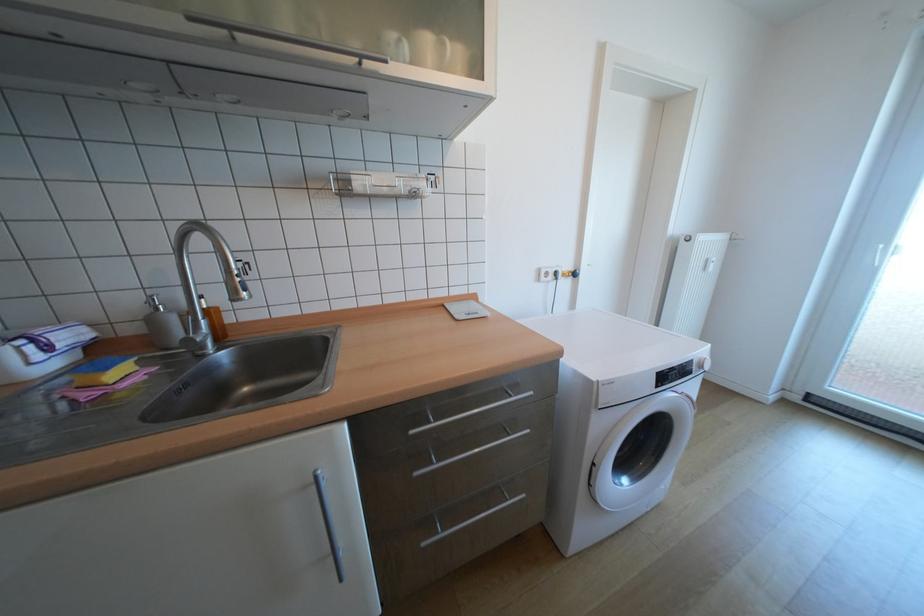
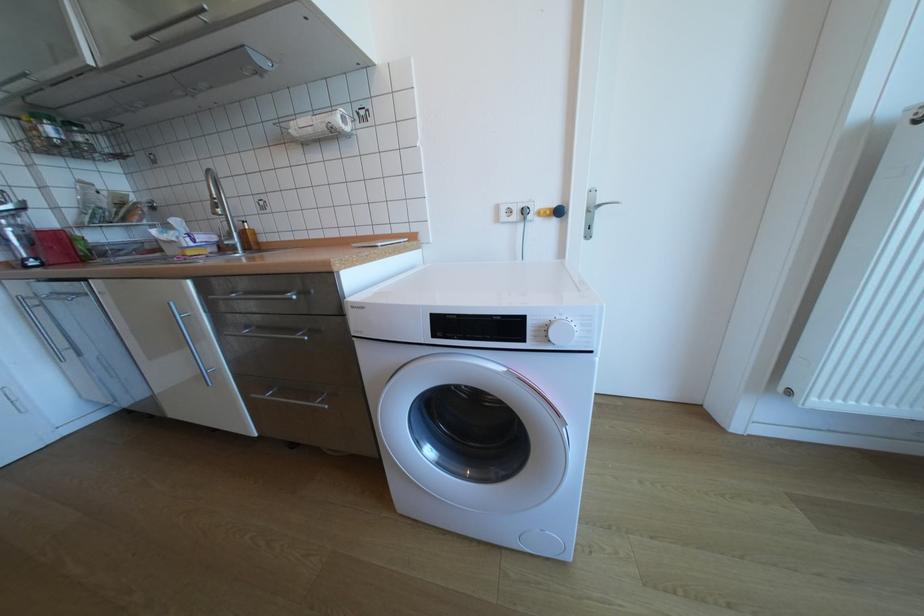
Locate, in the second image, the point that corresponds to point (555, 274) in the first image.

(518, 211)